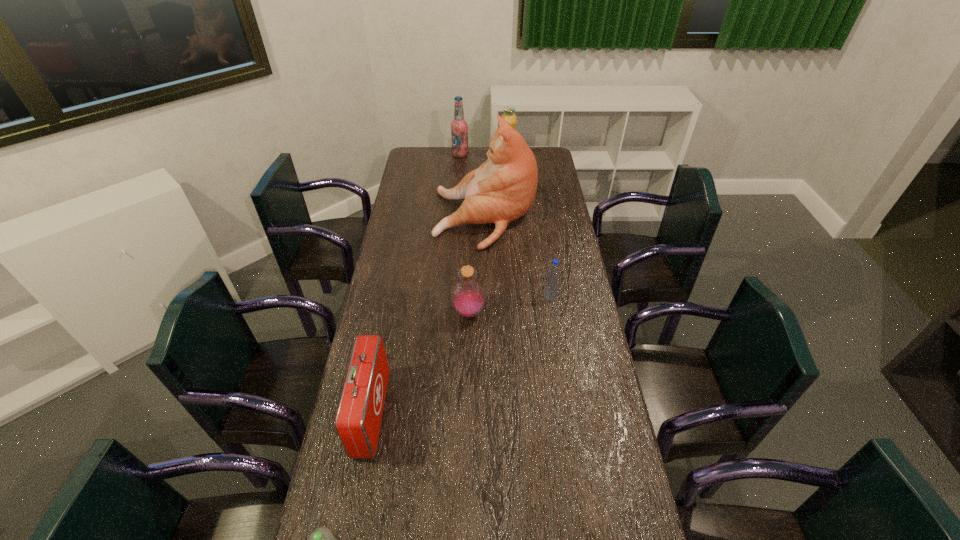
Image resolution: width=960 pixels, height=540 pixels. I want to click on vacant space located 0.130m on the front of the alcohol, so click(459, 172).

This screenshot has height=540, width=960. I want to click on vacant point located on the front label of the fruit juice, so click(x=511, y=207).

This screenshot has width=960, height=540. Find the location of `vacant position located 0.120m on the side of the first-aid kit with the first aid cross symbol`. vacant position located 0.120m on the side of the first-aid kit with the first aid cross symbol is located at coordinates pyautogui.click(x=423, y=414).

At what (x,y) coordinates should I click in order to perform the action: click on vacant region located 0.080m on the back of the bottle. Please return your answer as a coordinate pair (x, y). The image size is (960, 540). Looking at the image, I should click on (469, 285).

This screenshot has width=960, height=540. I want to click on vacant region located on the back of the right water bottle, so click(x=546, y=268).

Identify the location of alcohol that is at the far edge. The height and width of the screenshot is (540, 960). (459, 127).

You are a GUI agent. You are given a task and a screenshot of the screen. Output one action in this format:
    pyautogui.click(x=<x>, y=<y>)
    Task: Click on the fruit juice situated at the far edge
    
    Given the screenshot: What is the action you would take?
    pyautogui.click(x=509, y=116)

At what (x,y) coordinates should I click in order to perform the action: click on object that is at the left edge. Please return your answer as a coordinate pair (x, y). This screenshot has width=960, height=540. Looking at the image, I should click on (358, 419).

The height and width of the screenshot is (540, 960). I want to click on cat that is positioned at the right edge, so click(x=503, y=188).

This screenshot has width=960, height=540. I want to click on water bottle located in the right edge section of the desktop, so tap(552, 281).